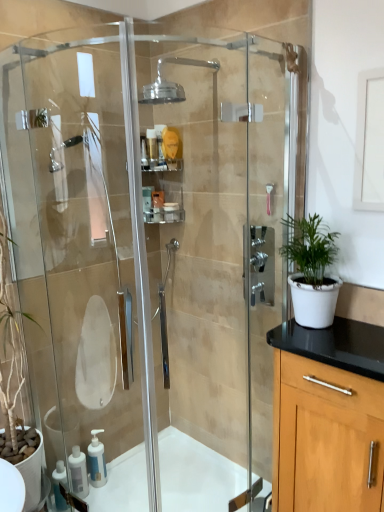
Find the location of a particular element. The width and height of the screenshot is (384, 512). unoccupied space behind transparent glass shower door at left is located at coordinates (138, 482).